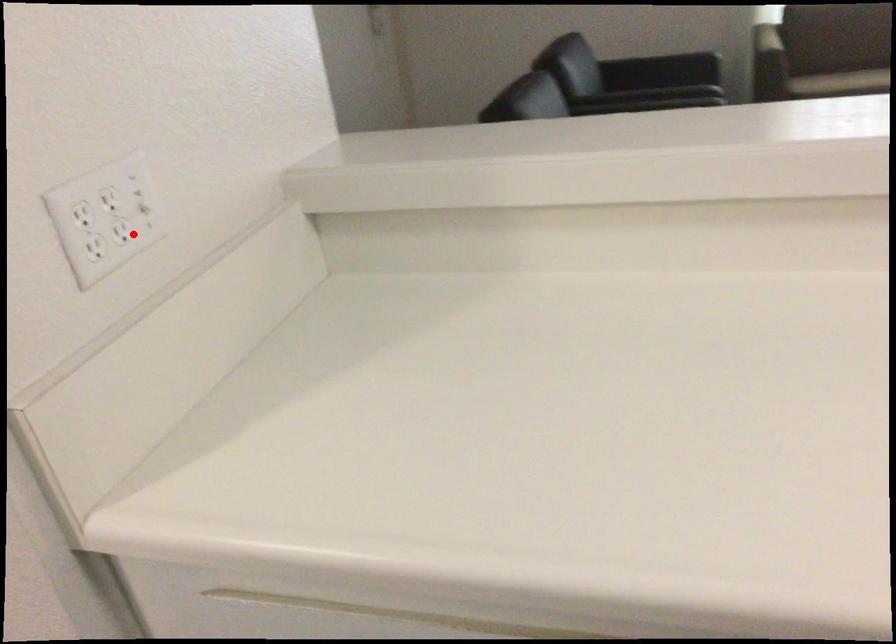
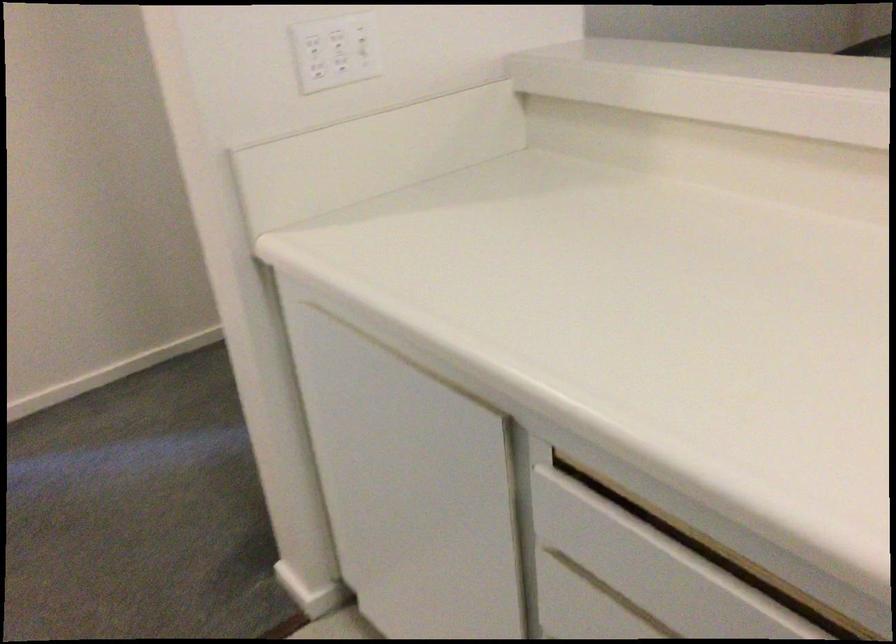
In the second image, find the point that corresponds to the highlighted location in the first image.

(349, 67)